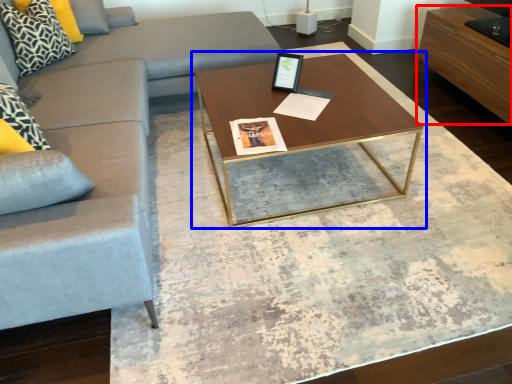
Question: Which object is further to the camera taking this photo, drawer (highlighted by a red box) or coffee table (highlighted by a blue box)?

Choices:
 (A) drawer
 (B) coffee table

Answer: (A)